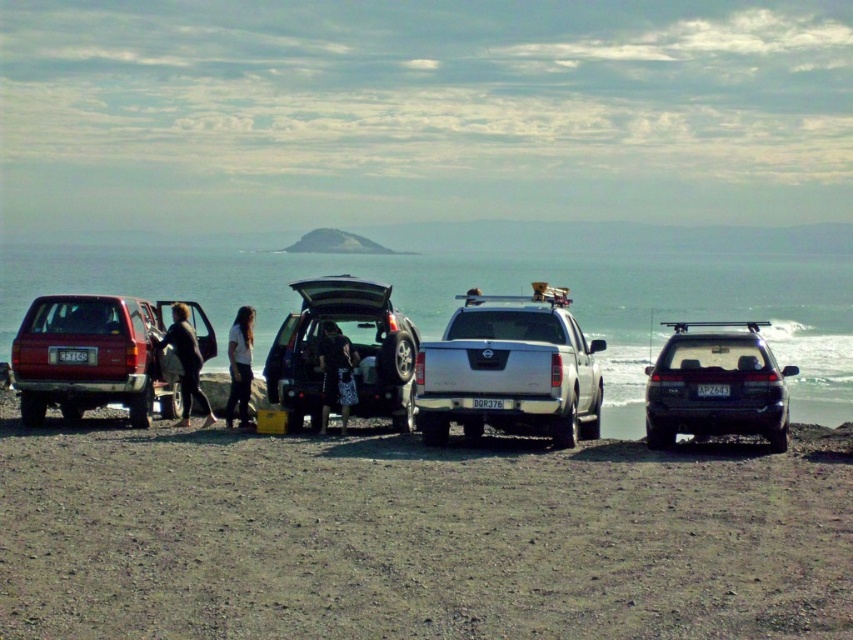
You are standing at the edge of the beach looking at the scene. There is a matte black suv at center and a white cotton shirt at center. Which object is positioned to the right of the other?

The matte black suv at center is to the right of the white cotton shirt at center.

You are a photographer standing at the edge of the sandy terrain. You need to take a photo that includes both the matte black suv at center and the white cotton shirt at center. Since the suv is taller, where should you position your camera to ensure both subjects are fully visible in the frame?

To capture both the matte black suv at center and the white cotton shirt at center in the same frame, position the camera lower to the ground. This will allow the taller matte black suv at center to be fully visible while also including the white cotton shirt at center without cropping either subject.